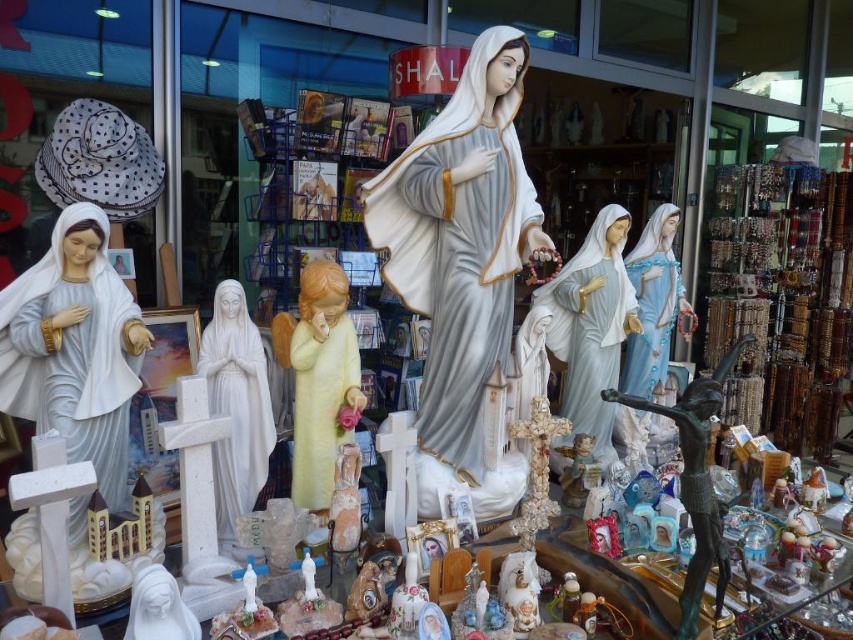
Question: Which point is closer to the camera?

Choices:
 (A) bronze statue at lower right
 (B) white porcelain statue at center

Answer: (A)

Question: Does porcelain statue at center appear on the right side of white porcelain statue at center?

Choices:
 (A) no
 (B) yes

Answer: (A)

Question: Observing the image, what is the correct spatial positioning of white porcelain statue at left in reference to white marble statue at center?

Choices:
 (A) right
 (B) left

Answer: (B)

Question: Is white porcelain statue at left thinner than matte blue fabric statue at right?

Choices:
 (A) no
 (B) yes

Answer: (B)

Question: Among these objects, which one is nearest to the camera?

Choices:
 (A) yellow matte angel at center
 (B) porcelain statue at center
 (C) white marble statue at center
 (D) bronze statue at lower right

Answer: (D)

Question: Based on their relative distances, which object is farther from the porcelain statue at center?

Choices:
 (A) white porcelain statue at left
 (B) white marble statue at center
 (C) bronze statue at lower right
 (D) matte blue fabric statue at right

Answer: (D)